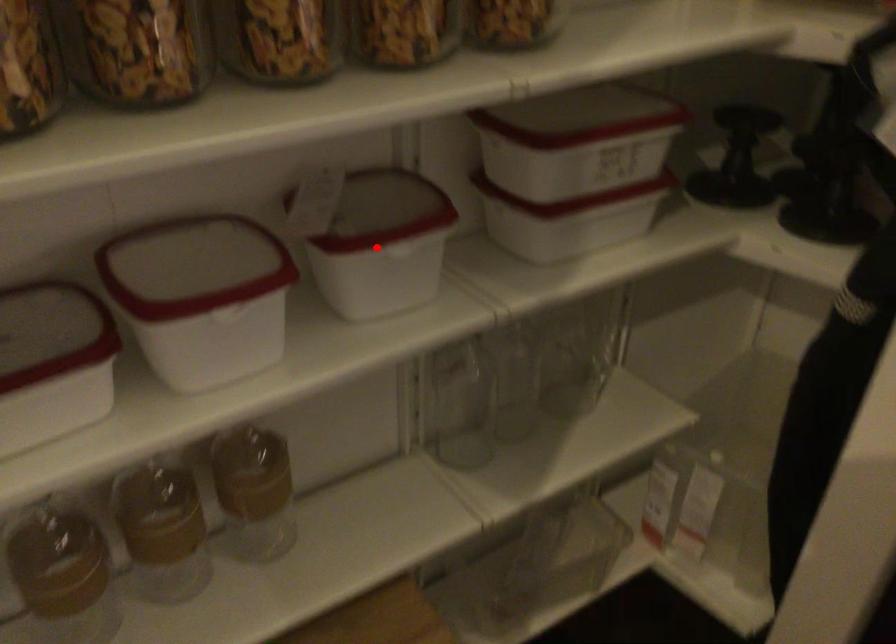
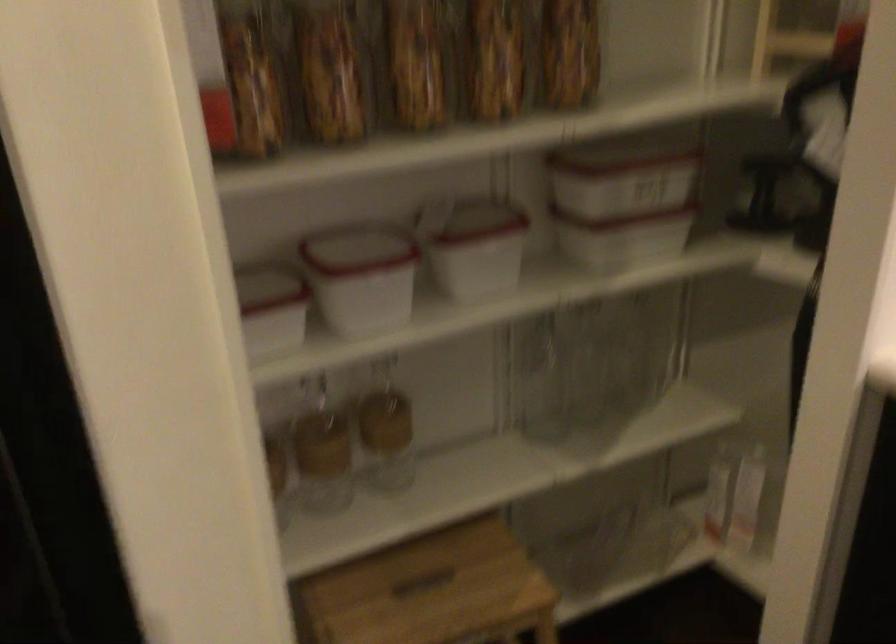
Find the pixel in the second image that matches the highlighted location in the first image.

(474, 245)